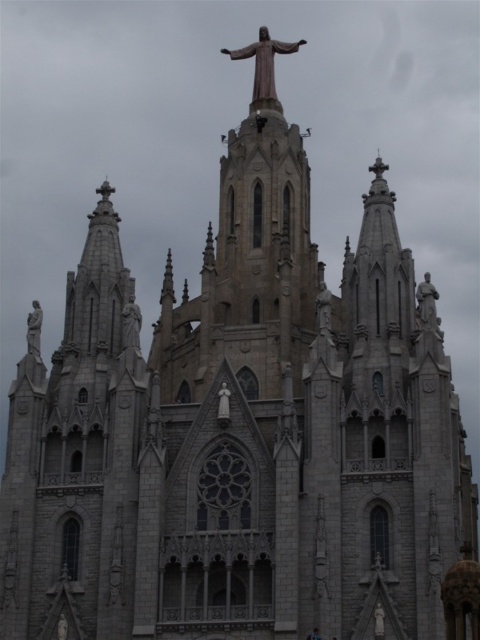
Consider the image. Is bronze statue at upper center taller than gray stone statue at center?

Correct, bronze statue at upper center is much taller as gray stone statue at center.

Is point (262, 51) positioned behind point (28, 337)?

Yes, point (262, 51) is farther from viewer.

Locate an element on the screen. bronze statue at upper center is located at coordinates (264, 67).

Based on the photo, is bronze statue at upper center above polished stone statue at center?

Correct, bronze statue at upper center is located above polished stone statue at center.

In the scene shown: Who is more distant from viewer, (x=269, y=48) or (x=330, y=314)?

Positioned behind is point (x=269, y=48).

Locate an element on the screen. bronze statue at upper center is located at coordinates (264, 67).

Does bronze statue at upper center have a larger size compared to white marble statue at right?

Yes, bronze statue at upper center is bigger than white marble statue at right.

Which is above, bronze statue at upper center or white marble statue at right?

bronze statue at upper center is above.

Does point (305, 40) come farther from viewer compared to point (421, 323)?

Yes, it is behind point (421, 323).

Find the location of a particular element. The height and width of the screenshot is (640, 480). bronze statue at upper center is located at coordinates (264, 67).